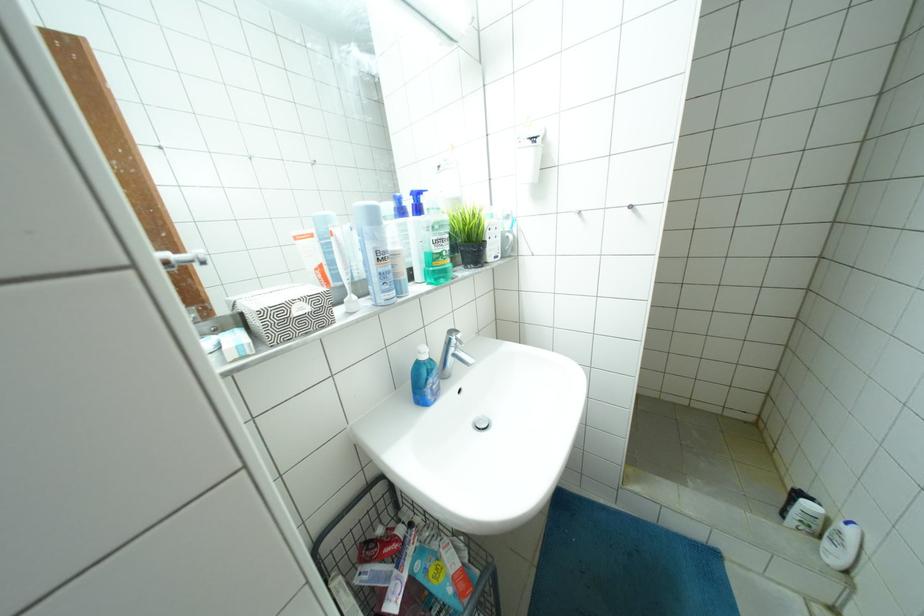
Find the location of a particular element. The height and width of the screenshot is (616, 924). red toothpaste tube is located at coordinates (380, 546).